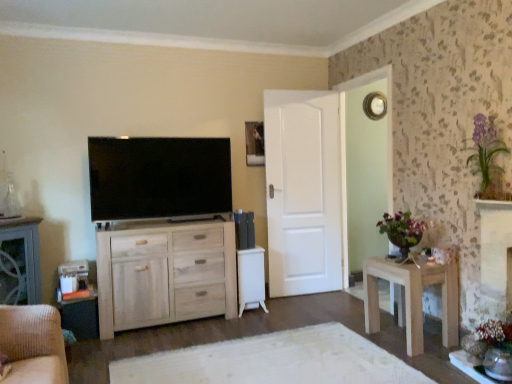
Where is `white matte door at center`? This screenshot has width=512, height=384. white matte door at center is located at coordinates (303, 191).

The height and width of the screenshot is (384, 512). Describe the element at coordinates (412, 298) in the screenshot. I see `light wood table at right` at that location.

Where is `matte gray cabinet at left`? Image resolution: width=512 pixels, height=384 pixels. matte gray cabinet at left is located at coordinates (20, 262).

Where is `matte black picture frame at upper center`? matte black picture frame at upper center is located at coordinates (254, 144).

Image resolution: width=512 pixels, height=384 pixels. What are the coordinates of `natural wood cabinet at center` in the screenshot? It's located at (165, 274).

You are a GUI agent. You are given a task and a screenshot of the screen. Output one action in this format:
    pyautogui.click(x=<x>, y=<y>)
    Task: Click on the matte white glass door at upper right
    This screenshot has width=512, height=384.
    Given the screenshot: What is the action you would take?
    pyautogui.click(x=365, y=167)

This screenshot has height=384, width=512. What are the coordinates of `white matte door at center` in the screenshot? It's located at (303, 191).

Does purple glass vase at upper right lie behind natural wood cabinet at center?

No, it is not.

I want to click on floral arrangement located above the natural wood cabinet at center (from the image's perspective), so [487, 157].

Considering the sizes of objects purple glass vase at upper right and natural wood cabinet at center in the image provided, who is shorter, purple glass vase at upper right or natural wood cabinet at center?

With less height is purple glass vase at upper right.

Does purple glass vase at upper right have a lesser width compared to natural wood cabinet at center?

Yes.

Is purple glass vase at upper right bigger than matte black picture frame at upper center?

Indeed, purple glass vase at upper right has a larger size compared to matte black picture frame at upper center.

Is purple glass vase at upper right not within matte black picture frame at upper center?

Indeed, purple glass vase at upper right is completely outside matte black picture frame at upper center.

From a real-world perspective, between purple glass vase at upper right and matte black picture frame at upper center, who is vertically lower?

In real-world perspective, purple glass vase at upper right is lower.

Who is taller, purple glass vase at upper right or matte black picture frame at upper center?

purple glass vase at upper right.

Considering the positions of objects light wood table at right and purple glass vase at upper right in the image provided, who is more to the right, light wood table at right or purple glass vase at upper right?

From the viewer's perspective, purple glass vase at upper right appears more on the right side.

Can you confirm if light wood table at right is wider than purple glass vase at upper right?

Correct, the width of light wood table at right exceeds that of purple glass vase at upper right.

Are light wood table at right and purple glass vase at upper right making contact?

No, light wood table at right is not next to purple glass vase at upper right.

Considering the relative sizes of light wood table at right and purple glass vase at upper right in the image provided, is light wood table at right smaller than purple glass vase at upper right?

Incorrect, light wood table at right is not smaller in size than purple glass vase at upper right.

Does point (474, 149) come closer to viewer compared to point (422, 331)?

That is True.

From the image's perspective, is purple glass vase at upper right on top of light wood table at right?

Indeed, from the image's perspective, purple glass vase at upper right is shown above light wood table at right.

Is purple glass vase at upper right aimed at light wood table at right?

No.

From a real-world perspective, who is located higher, purple glass vase at upper right or light wood table at right?

In real-world perspective, purple glass vase at upper right is above.

From their relative heights in the image, would you say white matte door at center is taller or shorter than matte black picture frame at upper center?

In the image, white matte door at center appears to be taller than matte black picture frame at upper center.

Which point is more distant from viewer, [306,242] or [254,156]?

The point [306,242] is farther from the camera.

Looking at this image, which object is further away from the camera taking this photo, white matte door at center or matte black picture frame at upper center?

matte black picture frame at upper center is more distant.

From a real-world perspective, between white matte door at center and matte black picture frame at upper center, who is vertically lower?

white matte door at center, from a real-world perspective.

Identify the location of glass door behind the flat screen tv at upper left. (365, 167).

From the image's perspective, would you say flat screen tv at upper left is positioned over matte white glass door at upper right?

Yes, from the image's perspective, flat screen tv at upper left is on top of matte white glass door at upper right.

Is point (116, 155) less distant than point (346, 137)?

Yes, it is.

Who is more distant, flat screen tv at upper left or matte gray cabinet at left?

flat screen tv at upper left.

In terms of height, does flat screen tv at upper left look taller or shorter compared to matte gray cabinet at left?

A: flat screen tv at upper left is shorter than matte gray cabinet at left.

From a real-world perspective, who is located lower, flat screen tv at upper left or matte gray cabinet at left?

In real-world perspective, matte gray cabinet at left is lower.

Looking at this image, in terms of size, does flat screen tv at upper left appear bigger or smaller than matte gray cabinet at left?

Clearly, flat screen tv at upper left is larger in size than matte gray cabinet at left.

Identify the location of the chest of drawers that appears behind the purple glass vase at upper right. (165, 274).

Where is `floral arrangement lying on the right of matte black picture frame at upper center`? The height and width of the screenshot is (384, 512). floral arrangement lying on the right of matte black picture frame at upper center is located at coordinates (487, 157).

When comparing their distances from matte black picture frame at upper center, does white matte door at center or light wood table at right seem closer?

Among the two, white matte door at center is located nearer to matte black picture frame at upper center.

Considering their positions, is matte black picture frame at upper center positioned further to flat screen tv at upper left than matte gray cabinet at left?

The object further to flat screen tv at upper left is matte black picture frame at upper center.

From the image, which object appears to be farther from matte black picture frame at upper center, natural wood cabinet at center or flat screen tv at upper left?

The object further to matte black picture frame at upper center is natural wood cabinet at center.

Based on their spatial positions, is light wood table at right or purple glass vase at upper right closer to flat screen tv at upper left?

Based on the image, light wood table at right appears to be nearer to flat screen tv at upper left.

Looking at the image, which one is located further to purple glass vase at upper right, matte black picture frame at upper center or matte white glass door at upper right?

matte black picture frame at upper center lies further to purple glass vase at upper right than the other object.

Looking at the image, which one is located further to natural wood cabinet at center, flat screen tv at upper left or light wood table at right?

light wood table at right.

When comparing their distances from matte black picture frame at upper center, does white matte door at center or matte gray cabinet at left seem closer?

white matte door at center is closer to matte black picture frame at upper center.

Considering their positions, is light wood table at right positioned further to flat screen tv at upper left than natural wood cabinet at center?

Among the two, light wood table at right is located further to flat screen tv at upper left.

What are the coordinates of `door situated between flat screen tv at upper left and light wood table at right from left to right` in the screenshot? It's located at (303, 191).

Where is `door located between flat screen tv at upper left and matte white glass door at upper right in the left-right direction`? door located between flat screen tv at upper left and matte white glass door at upper right in the left-right direction is located at coordinates (303, 191).

Where is `glass door situated between flat screen tv at upper left and purple glass vase at upper right from left to right`? This screenshot has height=384, width=512. glass door situated between flat screen tv at upper left and purple glass vase at upper right from left to right is located at coordinates (365, 167).

Identify the location of the chest of drawers located between matte gray cabinet at left and matte white glass door at upper right in the left-right direction. The height and width of the screenshot is (384, 512). (165, 274).